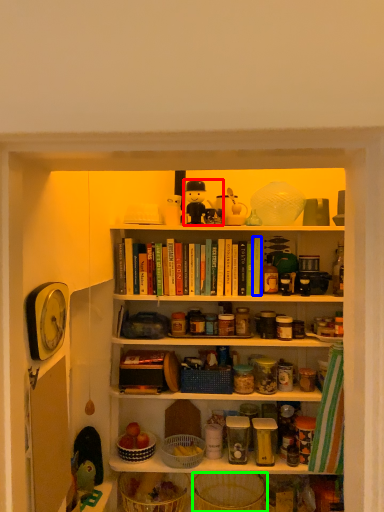
Question: Which object is the closest to the toy (highlighted by a red box)? Choose among these: book (highlighted by a blue box) or basket (highlighted by a green box).

Choices:
 (A) book
 (B) basket

Answer: (A)